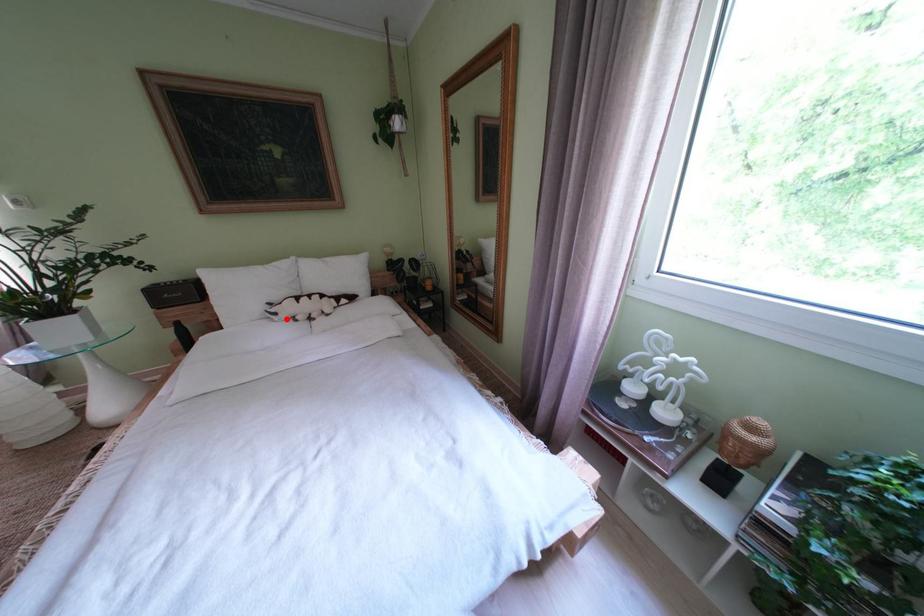
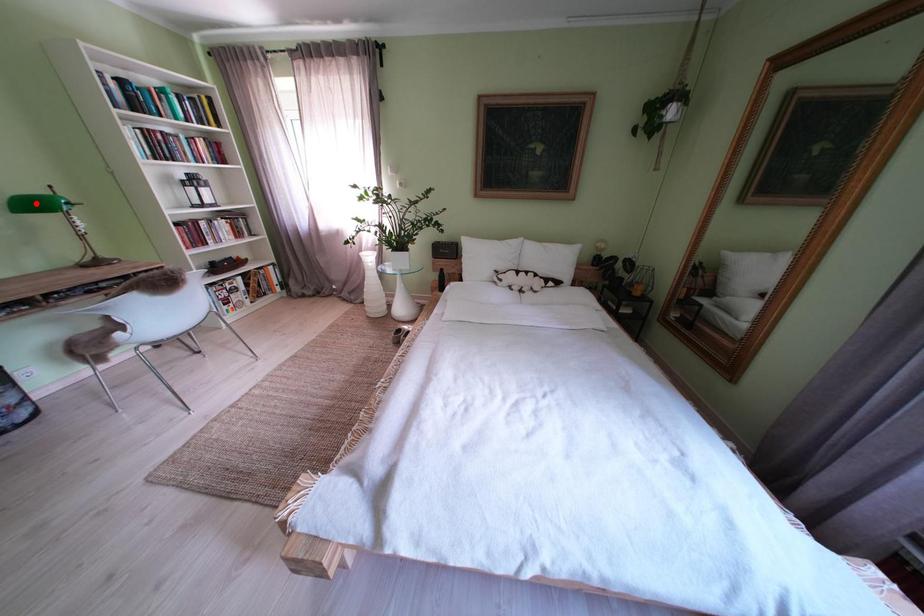
I am providing you with two images of the same scene from different viewpoints. A red point is marked on the first image and another point is marked on the second image. Do the highlighted points in image1 and image2 indicate the same real-world spot?

No